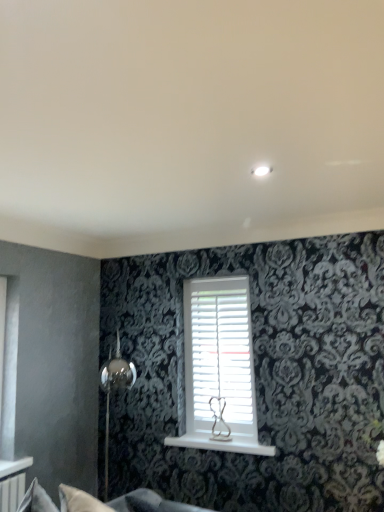
Question: Is white glossy window sill at center to the left of white matte shutter at center from the viewer's perspective?

Choices:
 (A) yes
 (B) no

Answer: (A)

Question: From a real-world perspective, is white glossy window sill at center positioned over white matte shutter at center based on gravity?

Choices:
 (A) no
 (B) yes

Answer: (A)

Question: Is white glossy window sill at center wider than white matte shutter at center?

Choices:
 (A) yes
 (B) no

Answer: (A)

Question: From the image's perspective, would you say white glossy window sill at center is positioned over white matte shutter at center?

Choices:
 (A) no
 (B) yes

Answer: (A)

Question: Are white glossy window sill at center and white matte shutter at center beside each other?

Choices:
 (A) yes
 (B) no

Answer: (B)

Question: From the image's perspective, is white glossy window sill at center below white matte shutter at center?

Choices:
 (A) no
 (B) yes

Answer: (B)

Question: Is soft gray fabric couch at lower left far from white glossy window sill at center?

Choices:
 (A) yes
 (B) no

Answer: (A)

Question: Does soft gray fabric couch at lower left have a lesser width compared to white glossy window sill at center?

Choices:
 (A) no
 (B) yes

Answer: (A)

Question: From a real-world perspective, does soft gray fabric couch at lower left stand above white glossy window sill at center?

Choices:
 (A) yes
 (B) no

Answer: (B)

Question: Would you say soft gray fabric couch at lower left contains white glossy window sill at center?

Choices:
 (A) yes
 (B) no

Answer: (B)

Question: Is soft gray fabric couch at lower left positioned before white glossy window sill at center?

Choices:
 (A) yes
 (B) no

Answer: (A)

Question: Is soft gray fabric couch at lower left outside white glossy window sill at center?

Choices:
 (A) yes
 (B) no

Answer: (A)

Question: Can you confirm if white matte shutter at center is positioned to the left of soft gray fabric couch at lower left?

Choices:
 (A) yes
 (B) no

Answer: (B)